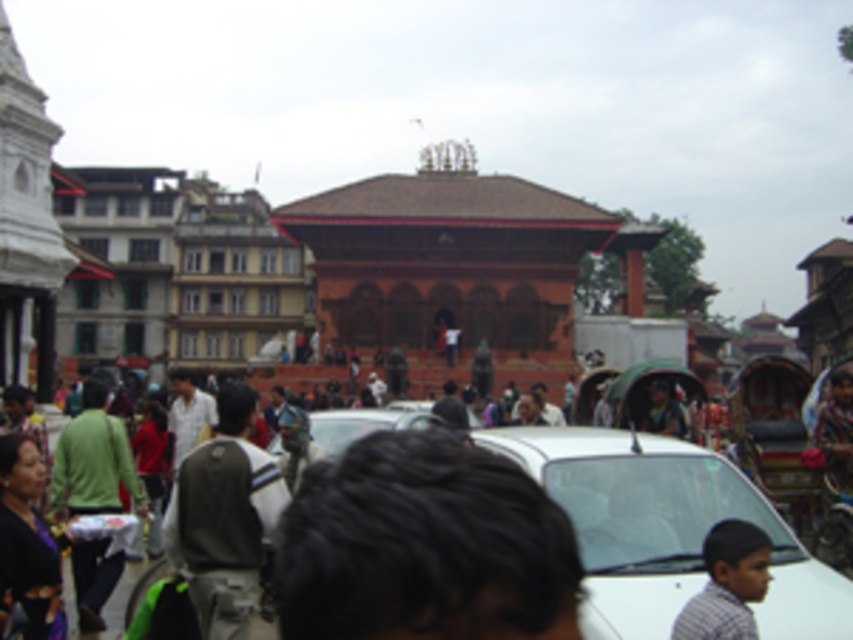
Question: Can you confirm if dark hair at center is smaller than khaki fabric backpack at center?

Choices:
 (A) yes
 (B) no

Answer: (B)

Question: Is white matte car at center further to camera compared to khaki fabric backpack at center?

Choices:
 (A) yes
 (B) no

Answer: (B)

Question: Considering the real-world distances, which object is closest to the white matte car at center?

Choices:
 (A) dark hair at center
 (B) khaki fabric backpack at center
 (C) dark purple fabric at lower left
 (D) light brown shirt at lower right

Answer: (D)

Question: Is white matte car at center behind khaki fabric backpack at center?

Choices:
 (A) no
 (B) yes

Answer: (A)

Question: Among these points, which one is nearest to the camera?

Choices:
 (A) (619, 483)
 (B) (260, 566)

Answer: (A)

Question: Based on their relative distances, which object is farther from the light brown shirt at lower right?

Choices:
 (A) khaki fabric backpack at center
 (B) dark hair at center

Answer: (A)